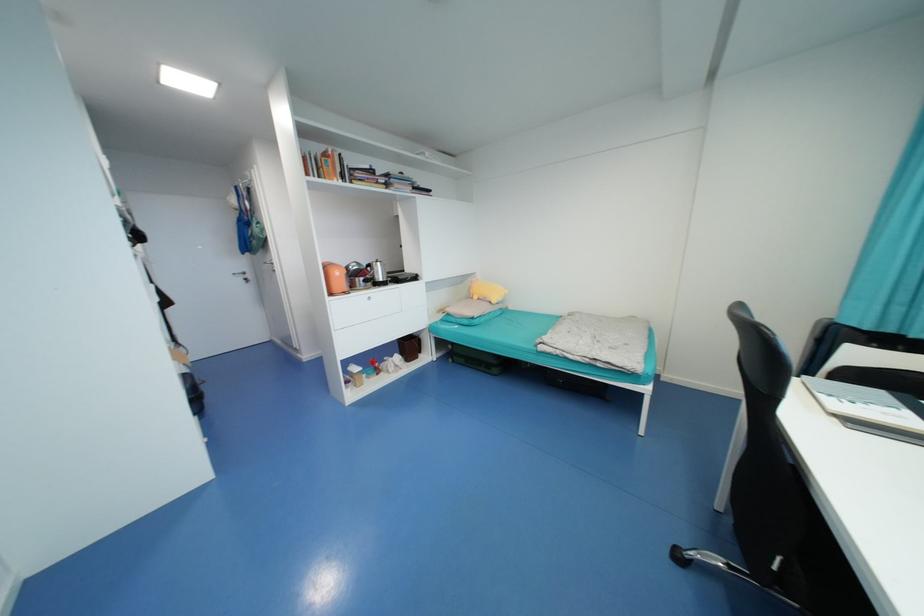
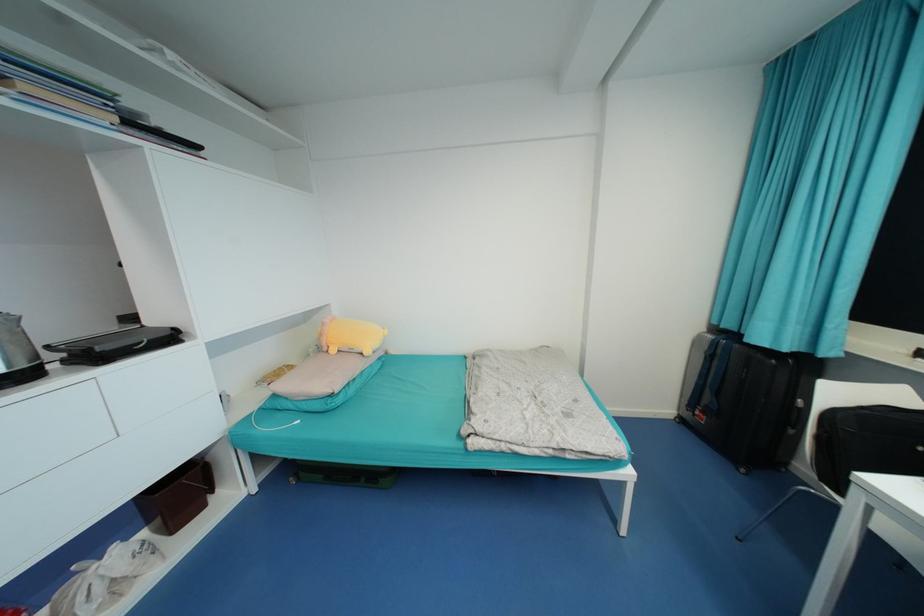
Where in the second image is the point corresponding to pixel 475 288 from the first image?

(325, 334)